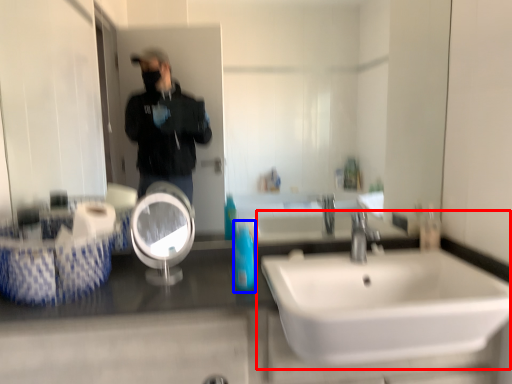
Question: Which of the following is the farthest to the observer, sink (highlighted by a red box) or mouthwash (highlighted by a blue box)?

Choices:
 (A) sink
 (B) mouthwash

Answer: (B)